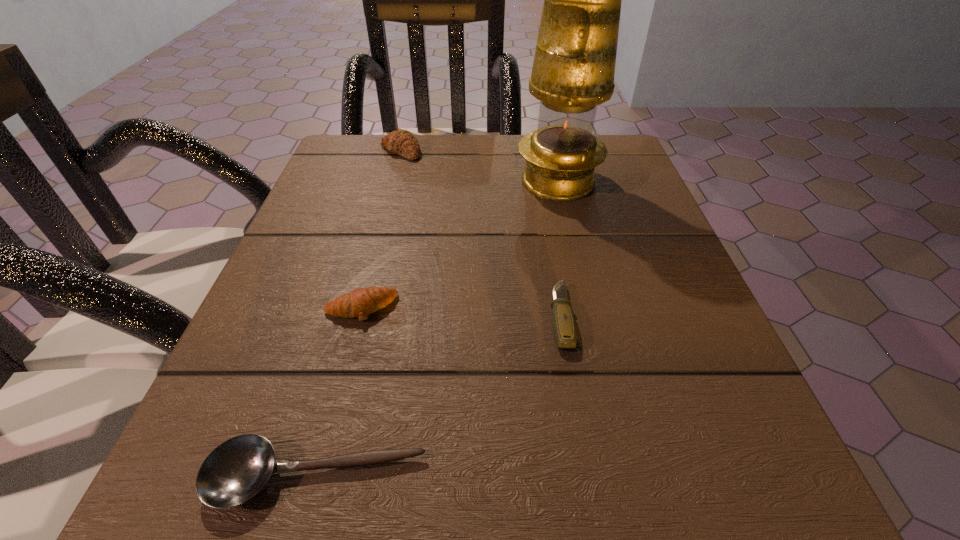
The image size is (960, 540). I want to click on unoccupied position between the taller crescent roll and the tallest object, so click(x=479, y=166).

Locate an element on the screen. The image size is (960, 540). vacant area that lies between the farther crescent roll and the pocketknife is located at coordinates (481, 234).

Locate an element on the screen. The height and width of the screenshot is (540, 960). free space between the shorter crescent roll and the pocketknife is located at coordinates (461, 313).

Find the location of a particular element. object that is the fourth closest to the ladle is located at coordinates (402, 142).

Image resolution: width=960 pixels, height=540 pixels. I want to click on object that is the nearest to the tallest object, so click(x=402, y=142).

Find the location of `free point that satisfies the following two spatial constraints: 1. on the back side of the pocketknife; 2. on the right side of the ladle`. free point that satisfies the following two spatial constraints: 1. on the back side of the pocketknife; 2. on the right side of the ladle is located at coordinates pyautogui.click(x=358, y=317).